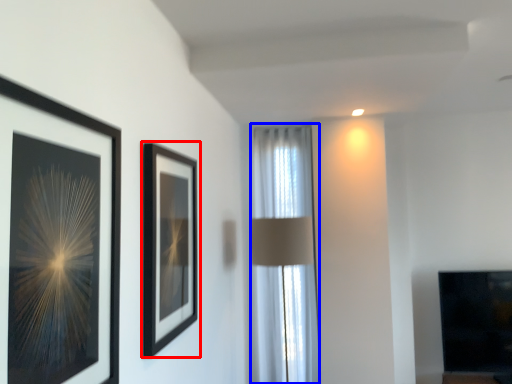
Question: Which point is closer to the camera, picture frame (highlighted by a red box) or curtain (highlighted by a blue box)?

Choices:
 (A) picture frame
 (B) curtain

Answer: (A)